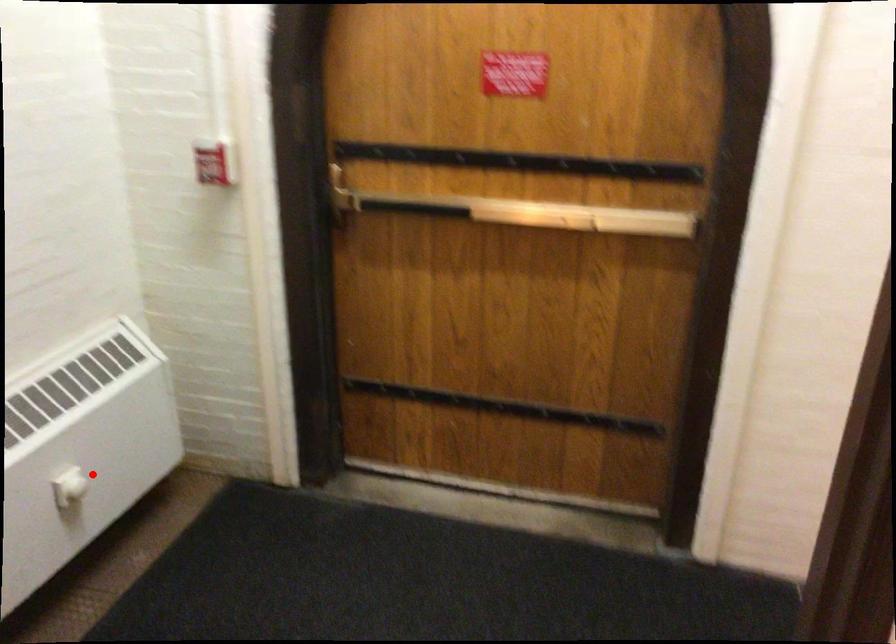
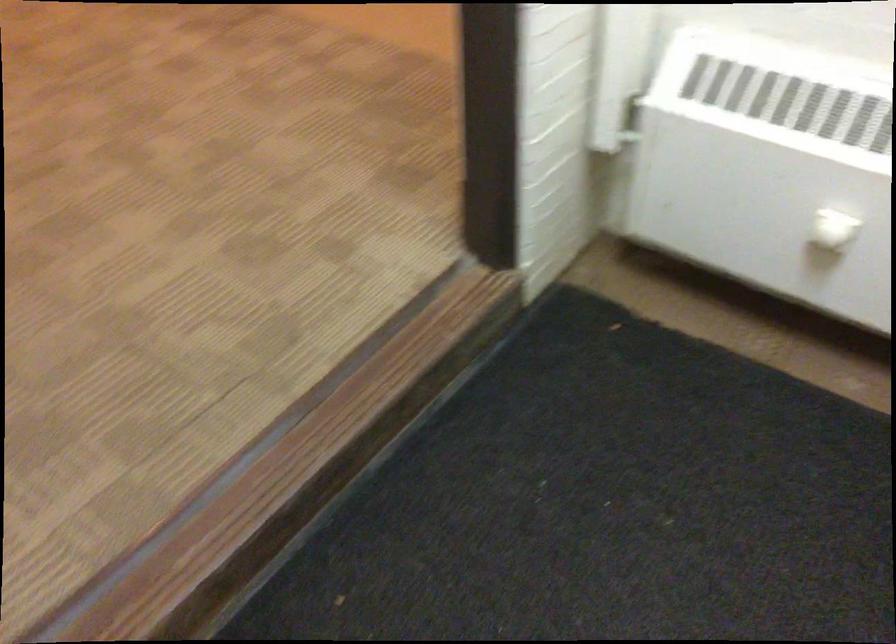
Question: I am providing you with two images of the same scene from different viewpoints. In image1, a red point is highlighted. Considering the same 3D point in image2, which of the following is correct?

Choices:
 (A) It is closer
 (B) It is farther

Answer: (A)